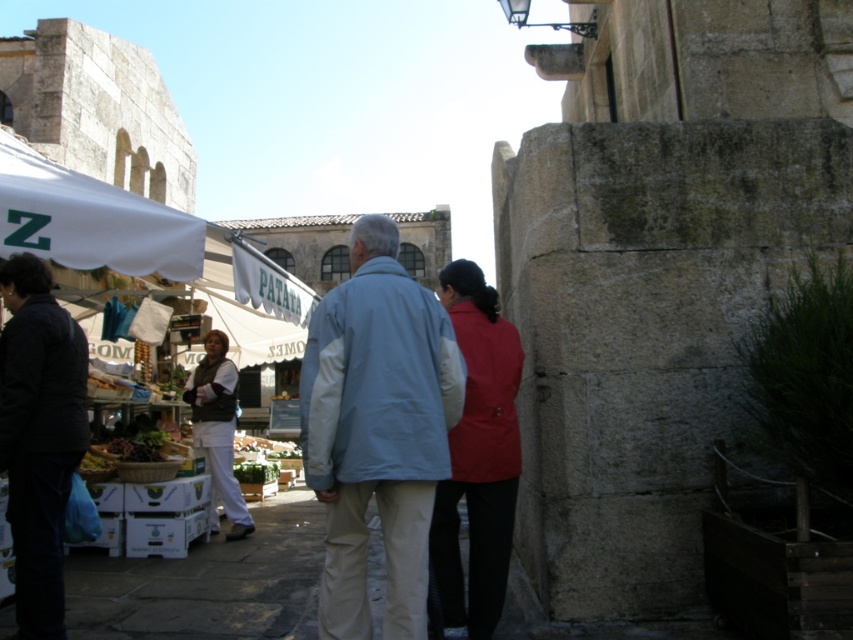
Question: Which object is closer to the camera taking this photo?

Choices:
 (A) dark blue fabric jacket at left
 (B) white cotton pants at lower left

Answer: (A)

Question: Is light blue fabric jacket at center smaller than dark blue fabric jacket at left?

Choices:
 (A) no
 (B) yes

Answer: (A)

Question: Which object is closer to the camera taking this photo?

Choices:
 (A) matte red jacket at center
 (B) dark blue fabric jacket at left
 (C) light blue fabric jacket at center
 (D) white cotton pants at lower left

Answer: (C)

Question: Does light blue fabric jacket at center lie in front of dark blue fabric jacket at left?

Choices:
 (A) yes
 (B) no

Answer: (A)

Question: Does light blue fabric jacket at center appear on the left side of matte red jacket at center?

Choices:
 (A) no
 (B) yes

Answer: (B)

Question: Which of these objects is positioned closest to the light blue fabric jacket at center?

Choices:
 (A) matte red jacket at center
 (B) dark blue fabric jacket at left
 (C) white cotton pants at lower left

Answer: (A)